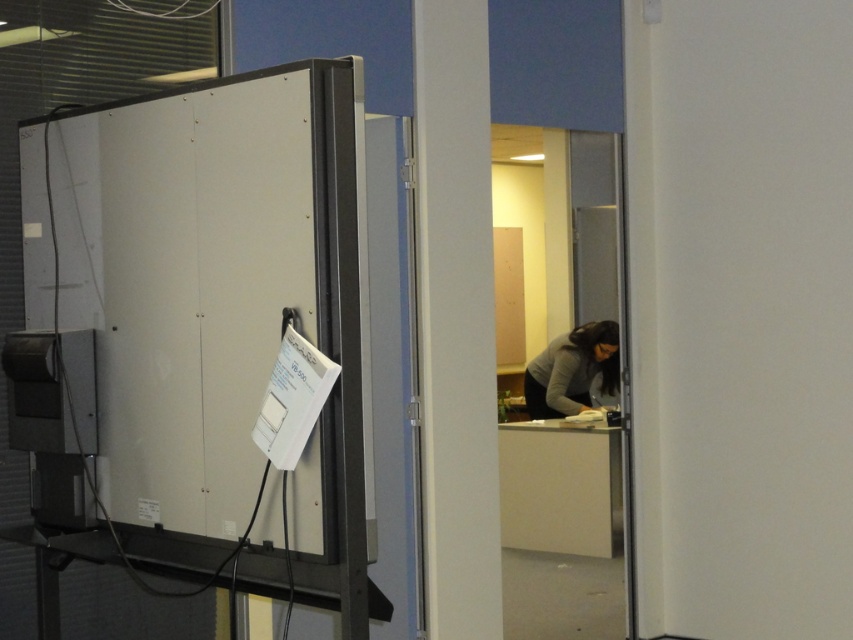
Which of these two, white smooth pillar at center or dark gray sweater at lower center, stands taller?

white smooth pillar at center

Does white smooth pillar at center have a lesser width compared to dark gray sweater at lower center?

Yes.

Does point (482, 284) come behind point (572, 368)?

That is False.

Where is `white smooth pillar at center`? The width and height of the screenshot is (853, 640). white smooth pillar at center is located at coordinates (456, 320).